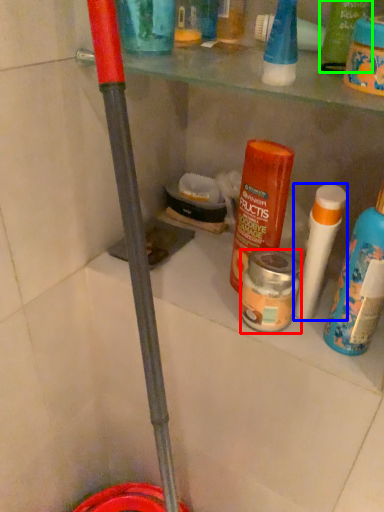
Question: Considering the real-world distances, which object is farthest from product (highlighted by a red box)? cleaning product (highlighted by a blue box) or product (highlighted by a green box)?

Choices:
 (A) cleaning product
 (B) product

Answer: (B)